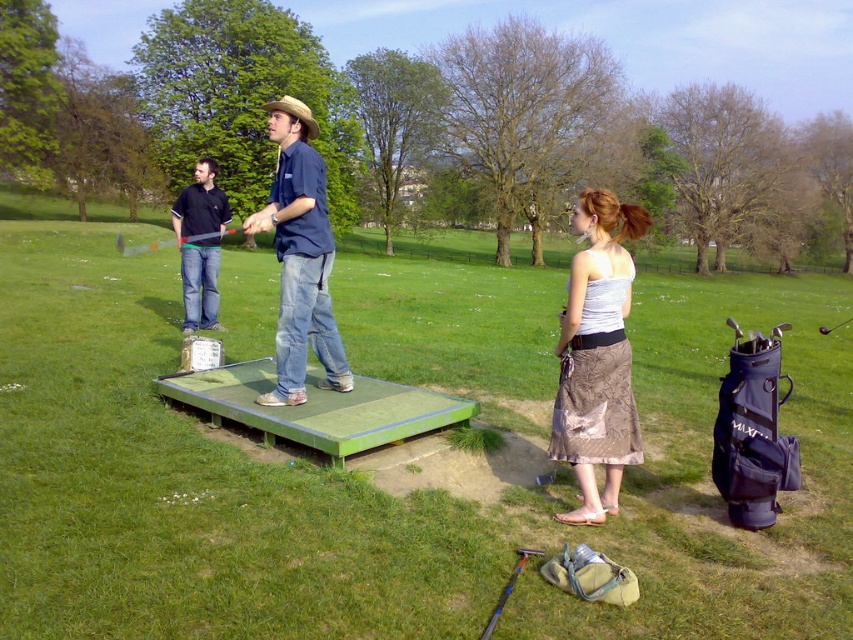
You are a photographer trying to capture a clear shot of the denim jeans at center and the metallic silver golf club at center. Since you want both items to appear equally prominent in the photo, which object should you zoom in on more?

The denim jeans at center has a smaller size compared to metallic silver golf club at center. To make them appear equally prominent, you should zoom in more on the denim jeans at center to compensate for its smaller size.